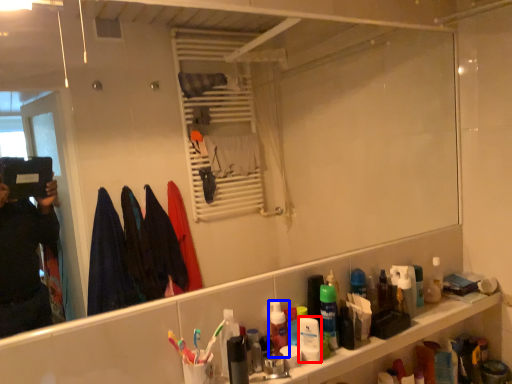
Question: Among these objects, which one is nearest to the camera, mouthwash (highlighted by a red box) or mouthwash (highlighted by a blue box)?

Choices:
 (A) mouthwash
 (B) mouthwash

Answer: (A)